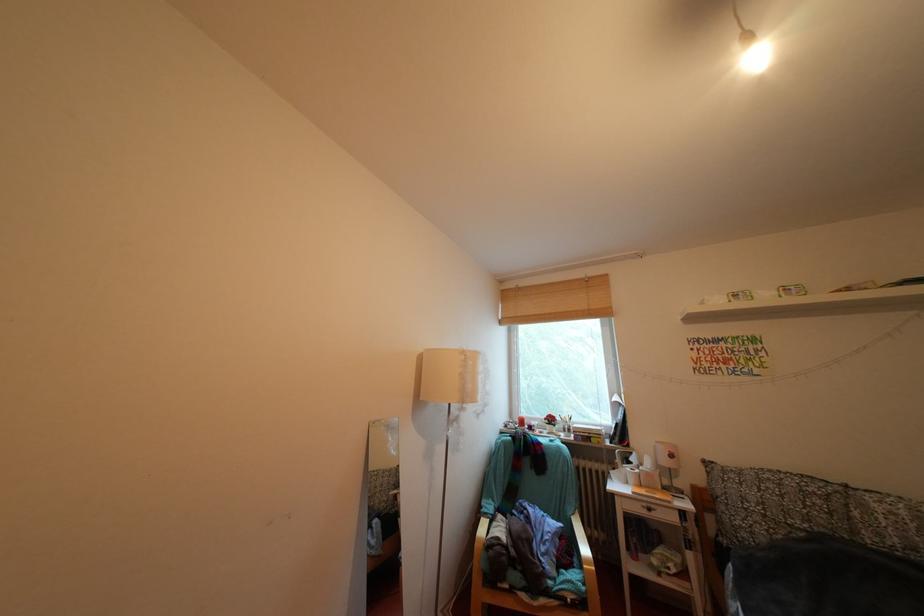
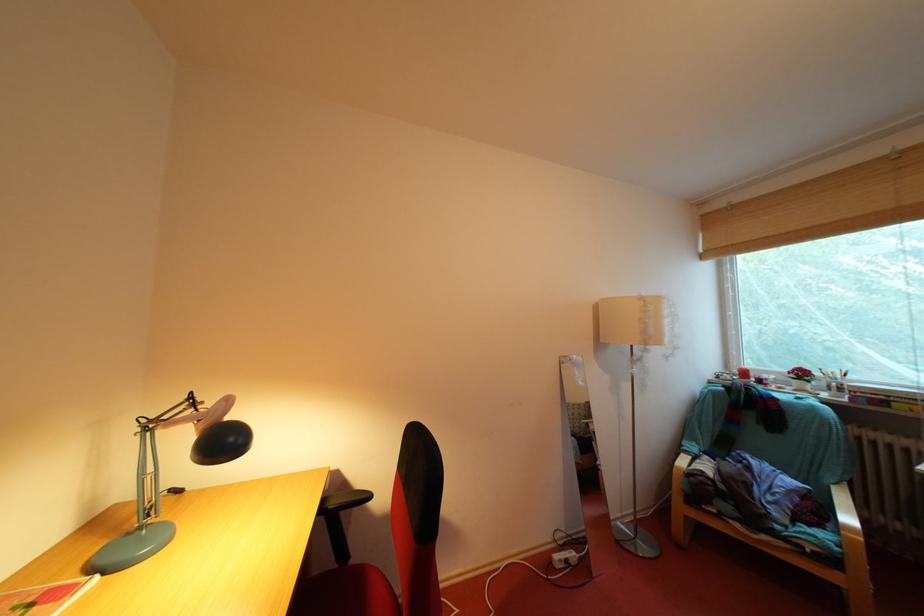
Where in the second image is the point corresponding to pixel 527 426 from the first image?

(746, 377)